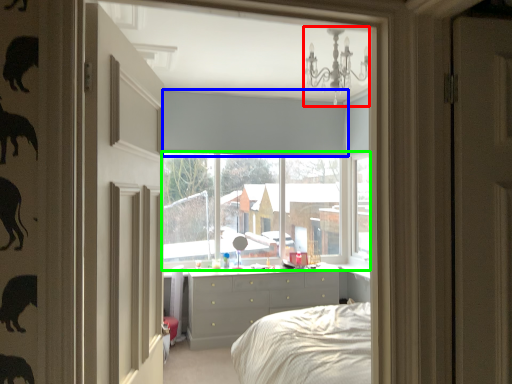
Question: Which is nearer to the light fixture (highlighted by a red box)? blind (highlighted by a blue box) or window (highlighted by a green box).

Choices:
 (A) blind
 (B) window

Answer: (A)